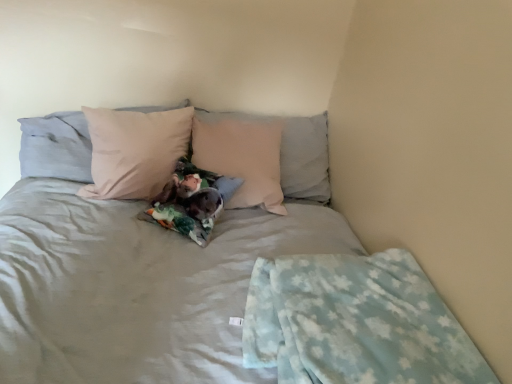
Question: Based on their positions, is matte pink pillow at upper left, acting as the second pillow starting from the right, located to the left or right of light blue fleece blanket at lower right?

Choices:
 (A) right
 (B) left

Answer: (B)

Question: From the image's perspective, is matte pink pillow at upper left, acting as the second pillow starting from the right, located above or below light blue fleece blanket at lower right?

Choices:
 (A) below
 (B) above

Answer: (B)

Question: Which is farther from the matte pink pillow at upper left, the 1th pillow viewed from the left?

Choices:
 (A) light pink fabric pillow at center, acting as the 2th pillow starting from the left
 (B) light blue fleece blanket at lower right

Answer: (B)

Question: Which object is positioned farthest from the light pink fabric pillow at center, which appears as the first pillow when viewed from the right?

Choices:
 (A) matte pink pillow at upper left, acting as the second pillow starting from the right
 (B) light blue fleece blanket at lower right

Answer: (B)